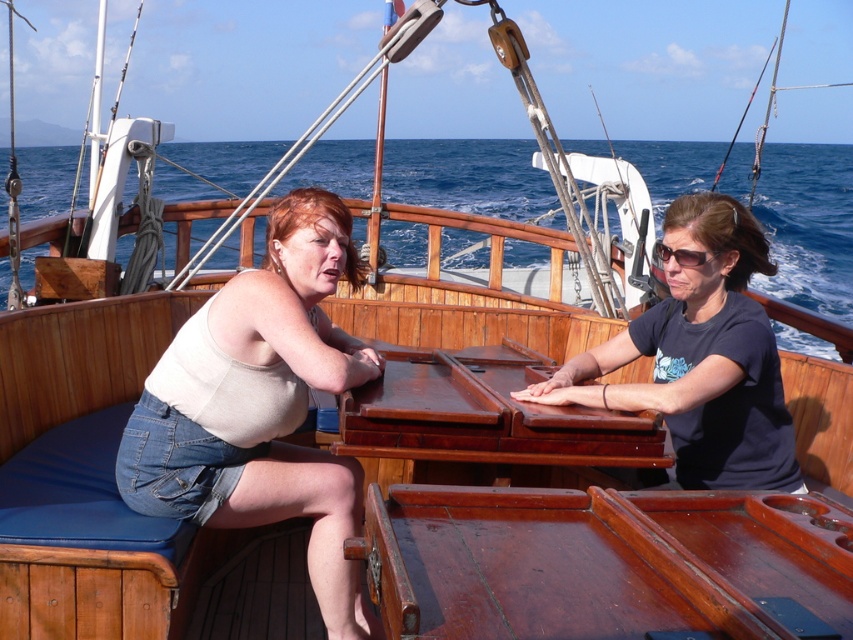
Does matte beige tank top at left appear on the right side of black plastic sunglasses at upper right?

In fact, matte beige tank top at left is to the left of black plastic sunglasses at upper right.

The image size is (853, 640). What do you see at coordinates (260, 404) in the screenshot?
I see `matte beige tank top at left` at bounding box center [260, 404].

This screenshot has width=853, height=640. I want to click on matte beige tank top at left, so click(260, 404).

Consider the image. Who is lower down, matte beige tank top at left or black matte shirt at center?

matte beige tank top at left is lower down.

Between point (198, 310) and point (662, 301), which one is positioned behind?

Positioned behind is point (662, 301).

Where is `matte beige tank top at left`? The width and height of the screenshot is (853, 640). matte beige tank top at left is located at coordinates point(260,404).

Between blue water at center and black plastic sunglasses at upper right, which one is positioned lower?

Positioned lower is black plastic sunglasses at upper right.

Can you confirm if blue water at center is positioned above black plastic sunglasses at upper right?

Correct, blue water at center is located above black plastic sunglasses at upper right.

Does point (824, 198) come closer to viewer compared to point (677, 248)?

No, it is behind (677, 248).

Image resolution: width=853 pixels, height=640 pixels. I want to click on blue water at center, so click(808, 225).